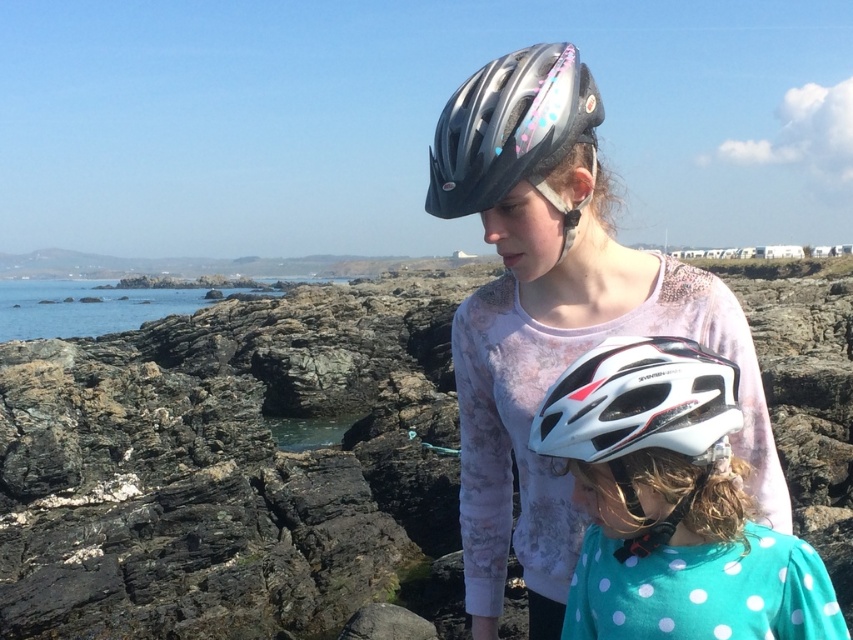
Between white matte helmet at center and shiny metallic helmet at upper center, which one appears on the right side from the viewer's perspective?

From the viewer's perspective, white matte helmet at center appears more on the right side.

Does white matte helmet at center appear over shiny metallic helmet at upper center?

No.

Is point (821, 624) closer to viewer compared to point (468, 164)?

Yes.

Where is `white matte helmet at center`? This screenshot has width=853, height=640. white matte helmet at center is located at coordinates (672, 504).

Which is above, white matte bicycle helmet at center or shiny metallic helmet at upper center?

Positioned higher is shiny metallic helmet at upper center.

Does point (556, 438) come in front of point (511, 124)?

Yes.

You are a GUI agent. You are given a task and a screenshot of the screen. Output one action in this format:
    pyautogui.click(x=<x>, y=<y>)
    Task: Click on the white matte bicycle helmet at center
    The height and width of the screenshot is (640, 853).
    Given the screenshot: What is the action you would take?
    pyautogui.click(x=640, y=403)

Where is `white matte bicycle helmet at center`? The height and width of the screenshot is (640, 853). white matte bicycle helmet at center is located at coordinates (640, 403).

Can you confirm if rough textured rocks at center is smaller than shiny metallic helmet at upper center?

Actually, rough textured rocks at center might be larger than shiny metallic helmet at upper center.

Is rough textured rocks at center in front of shiny metallic helmet at upper center?

Yes.

Find the location of a particular element. rough textured rocks at center is located at coordinates (233, 468).